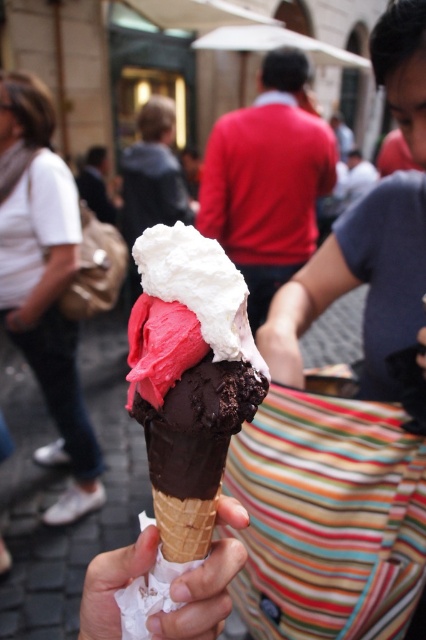
You are standing at the point labeled point [181,346] and want to throw a small pebble to hit the person in the bright red sweater. The distance between you and the person in the bright red sweater is 18.75 inches. If your throwing range is up to 20 inches, can you successfully hit them?

Yes, since the distance between you and the person in the bright red sweater is 18.75 inches, which is within your throwing range of up to 20 inches, you can successfully hit them.